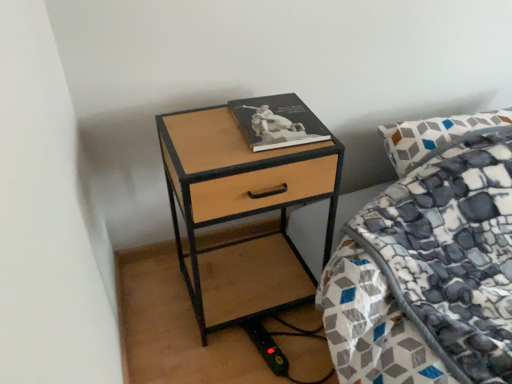
I want to click on blank area to the left of hardcover book at upper right, so click(205, 127).